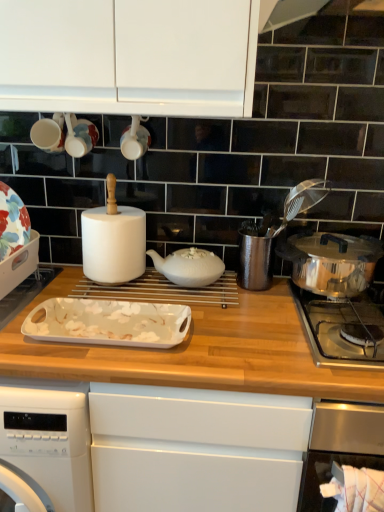
I want to click on vacant region below white ceramic teapot at center (from a real-world perspective), so click(176, 286).